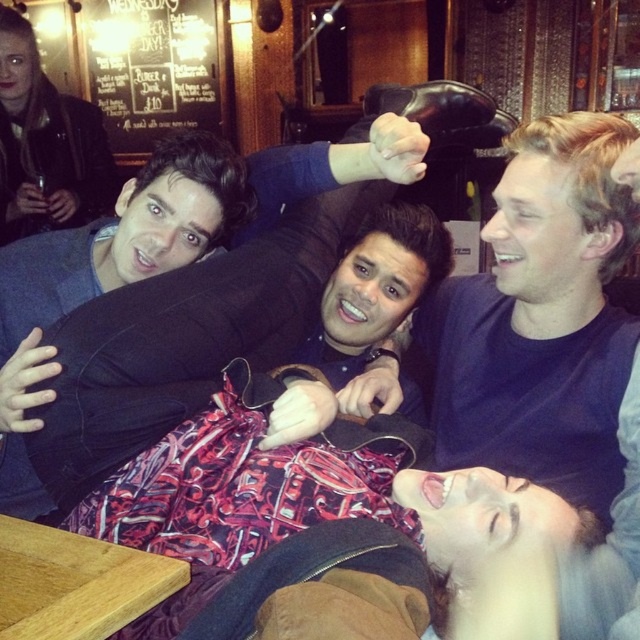
You are a painter standing in front of the black chalkboard menu at upper left and the dark blue sweater at center. You want to paint both objects. Which object should you paint first if you want to start with the one closer to you?

The dark blue sweater at center is closer to you than the black chalkboard menu at upper left, so you should paint the dark blue sweater at center first.